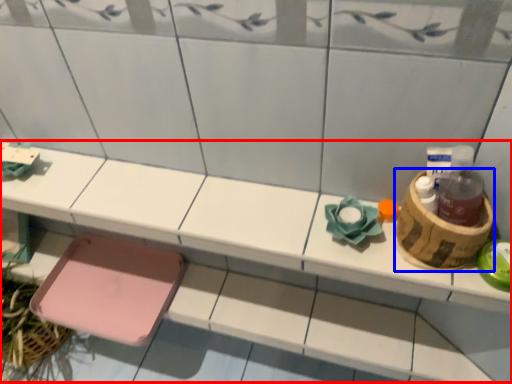
Question: Which object appears closest to the camera in this image, vanity (highlighted by a red box) or basket (highlighted by a blue box)?

Choices:
 (A) vanity
 (B) basket

Answer: (B)